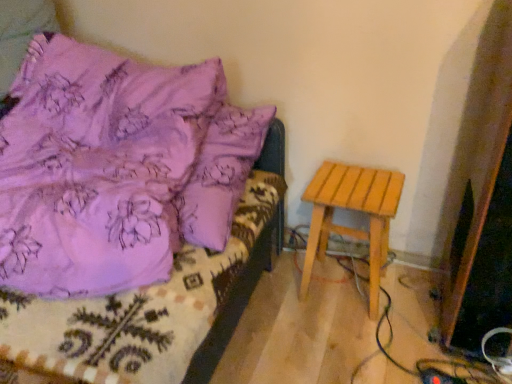
Locate an element on the screen. This screenshot has width=512, height=384. light brown wooden stool at right is located at coordinates (355, 210).

Measure the distance between light brown wooden stool at right and camera.

light brown wooden stool at right and camera are 1.32 meters apart.

The height and width of the screenshot is (384, 512). Describe the element at coordinates (355, 210) in the screenshot. I see `light brown wooden stool at right` at that location.

What do you see at coordinates (122, 210) in the screenshot? The width and height of the screenshot is (512, 384). I see `purple fabric bed at upper left` at bounding box center [122, 210].

Identify the location of purple fabric bed at upper left. The width and height of the screenshot is (512, 384). (122, 210).

Where is `light brown wooden stool at right`? light brown wooden stool at right is located at coordinates (355, 210).

Between light brown wooden stool at right and purple fabric bed at upper left, which one appears on the right side from the viewer's perspective?

Result: light brown wooden stool at right.

Relative to purple fabric bed at upper left, is light brown wooden stool at right in front or behind?

In the image, light brown wooden stool at right appears behind purple fabric bed at upper left.

Which point is more forward, (308,195) or (18,356)?

Positioned in front is point (18,356).

From the image's perspective, is light brown wooden stool at right beneath purple fabric bed at upper left?

Yes.

From a real-world perspective, is light brown wooden stool at right above or below purple fabric bed at upper left?

light brown wooden stool at right is situated lower than purple fabric bed at upper left in the real world.

Considering the sizes of light brown wooden stool at right and purple fabric bed at upper left in the image, is light brown wooden stool at right wider or thinner than purple fabric bed at upper left?

light brown wooden stool at right is thinner than purple fabric bed at upper left.

Is light brown wooden stool at right taller than purple fabric bed at upper left?

No.

Considering the sizes of light brown wooden stool at right and purple fabric bed at upper left in the image, is light brown wooden stool at right bigger or smaller than purple fabric bed at upper left?

Result: light brown wooden stool at right is smaller than purple fabric bed at upper left.

Is light brown wooden stool at right situated inside purple fabric bed at upper left or outside?

light brown wooden stool at right is outside purple fabric bed at upper left.

Is light brown wooden stool at right with purple fabric bed at upper left?

light brown wooden stool at right and purple fabric bed at upper left are not in contact.

Looking at this image, is light brown wooden stool at right facing towards purple fabric bed at upper left?

No, light brown wooden stool at right is not facing towards purple fabric bed at upper left.

Where is `stool lying behind the purple fabric bed at upper left`? The height and width of the screenshot is (384, 512). stool lying behind the purple fabric bed at upper left is located at coordinates coord(355,210).

Would you say purple fabric bed at upper left is to the left or to the right of light brown wooden stool at right in the picture?

purple fabric bed at upper left is to the left of light brown wooden stool at right.

Which object is further away from the camera, purple fabric bed at upper left or light brown wooden stool at right?

light brown wooden stool at right is further from the camera.

Is point (110, 300) in front of point (387, 205)?

Yes, it is.

From the image's perspective, is purple fabric bed at upper left below light brown wooden stool at right?

No, from the image's perspective, purple fabric bed at upper left is not below light brown wooden stool at right.

From a real-world perspective, who is located lower, purple fabric bed at upper left or light brown wooden stool at right?

light brown wooden stool at right.

Is purple fabric bed at upper left wider or thinner than light brown wooden stool at right?

In the image, purple fabric bed at upper left appears to be wider than light brown wooden stool at right.

Can you confirm if purple fabric bed at upper left is shorter than light brown wooden stool at right?

In fact, purple fabric bed at upper left may be taller than light brown wooden stool at right.

Does purple fabric bed at upper left have a smaller size compared to light brown wooden stool at right?

Incorrect, purple fabric bed at upper left is not smaller in size than light brown wooden stool at right.

Is purple fabric bed at upper left located outside light brown wooden stool at right?

Yes, purple fabric bed at upper left is outside of light brown wooden stool at right.

Is the surface of purple fabric bed at upper left in direct contact with light brown wooden stool at right?

No, purple fabric bed at upper left is not in contact with light brown wooden stool at right.

Is purple fabric bed at upper left looking in the opposite direction of light brown wooden stool at right?

purple fabric bed at upper left does not have its back to light brown wooden stool at right.

Based on the photo, how many degrees apart are the facing directions of purple fabric bed at upper left and light brown wooden stool at right?

14.5 degrees.

Measure the distance from purple fabric bed at upper left to light brown wooden stool at right.

A distance of 52.64 centimeters exists between purple fabric bed at upper left and light brown wooden stool at right.

Where is `stool located on the right of purple fabric bed at upper left`? This screenshot has width=512, height=384. stool located on the right of purple fabric bed at upper left is located at coordinates (355, 210).

The height and width of the screenshot is (384, 512). Identify the location of furniture on the left of light brown wooden stool at right. (122, 210).

You are a GUI agent. You are given a task and a screenshot of the screen. Output one action in this format:
    pyautogui.click(x=<x>, y=<y>)
    Task: Click on the stool to the right of purple fabric bed at upper left
    
    Given the screenshot: What is the action you would take?
    (x=355, y=210)